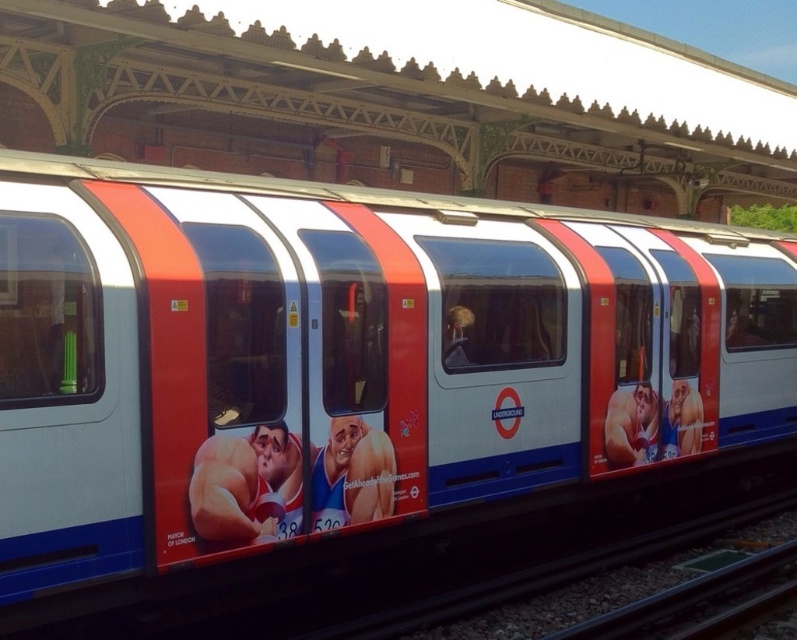
Between metallic silver train at center and metal/smooth train track at bottom, which one appears on the left side from the viewer's perspective?

From the viewer's perspective, metallic silver train at center appears more on the left side.

What do you see at coordinates (346, 362) in the screenshot? I see `metallic silver train at center` at bounding box center [346, 362].

Is point (509, 330) more distant than point (768, 560)?

No, it is in front of (768, 560).

At what (x,y) coordinates should I click in order to perform the action: click on metallic silver train at center. Please return your answer as a coordinate pair (x, y). The height and width of the screenshot is (640, 797). Looking at the image, I should click on (x=346, y=362).